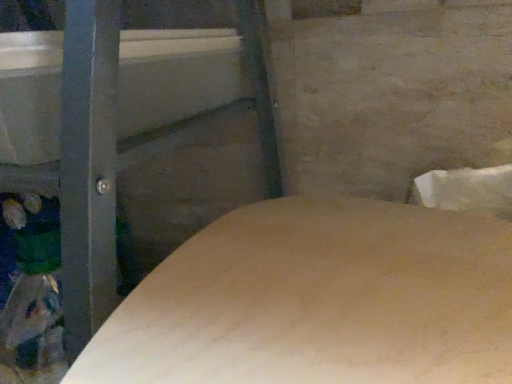
The height and width of the screenshot is (384, 512). Describe the element at coordinates (318, 301) in the screenshot. I see `beige matte table at center` at that location.

The image size is (512, 384). I want to click on beige matte table at center, so click(x=318, y=301).

Where is `beige matte table at center`? beige matte table at center is located at coordinates (318, 301).